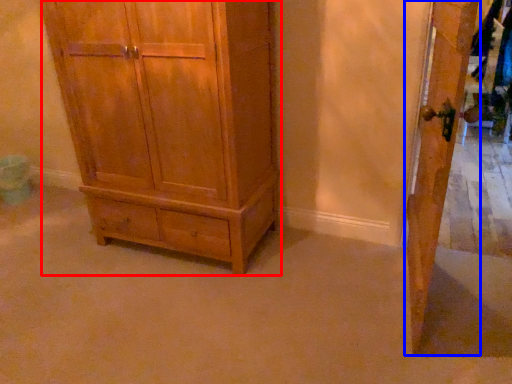
Question: Which of the following is the farthest to the observer, chest of drawers (highlighted by a red box) or door (highlighted by a blue box)?

Choices:
 (A) chest of drawers
 (B) door

Answer: (A)